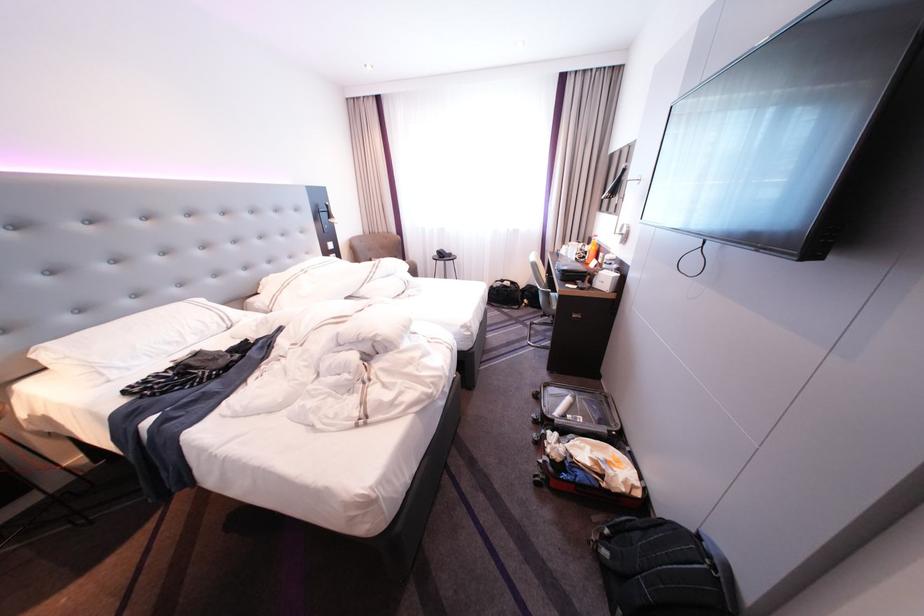
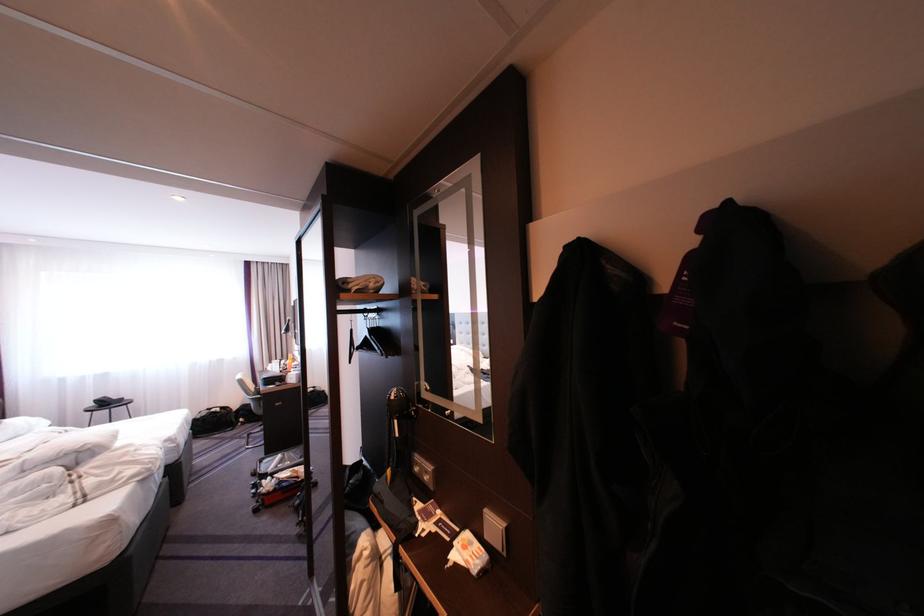
The point at (552, 286) is marked in the first image. Where is the corresponding point in the second image?

(261, 395)